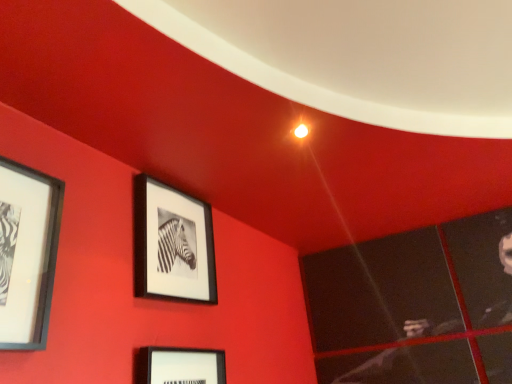
Question: Is point tap(173, 210) closer or farther from the camera than point tap(14, 177)?

Choices:
 (A) farther
 (B) closer

Answer: (A)

Question: In terms of height, does matte black picture frame at center, the second picture frame positioned from the left, look taller or shorter compared to matte black picture frame at left, the 2th picture frame when ordered from right to left?

Choices:
 (A) tall
 (B) short

Answer: (A)

Question: Considering the positions of matte black picture frame at center, the first picture frame viewed from the back, and matte black picture frame at left, which ranks as the 1th picture frame in left-to-right order, in the image, is matte black picture frame at center, the first picture frame viewed from the back, wider or thinner than matte black picture frame at left, which ranks as the 1th picture frame in left-to-right order,?

Choices:
 (A) wide
 (B) thin

Answer: (B)

Question: Is matte black picture frame at left, the 2th picture frame when ordered from right to left, inside or outside of matte black picture frame at center, the first picture frame in the right-to-left sequence?

Choices:
 (A) outside
 (B) inside

Answer: (A)

Question: Looking at their shapes, would you say matte black picture frame at left, positioned as the first picture frame in front-to-back order, is wider or thinner than matte black picture frame at center, the first picture frame in the right-to-left sequence?

Choices:
 (A) wide
 (B) thin

Answer: (A)

Question: Does point 53,244 appear closer or farther from the camera than point 199,299?

Choices:
 (A) farther
 (B) closer

Answer: (B)

Question: Considering the positions of matte black picture frame at left, acting as the 2th picture frame starting from the back, and matte black picture frame at center, the second picture frame positioned from the left, in the image, is matte black picture frame at left, acting as the 2th picture frame starting from the back, taller or shorter than matte black picture frame at center, the second picture frame positioned from the left,?

Choices:
 (A) tall
 (B) short

Answer: (B)